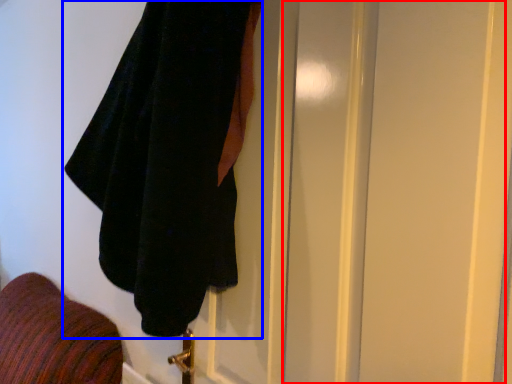
Question: Which point is closer to the camera, screen door (highlighted by a red box) or towel (highlighted by a blue box)?

Choices:
 (A) screen door
 (B) towel

Answer: (A)